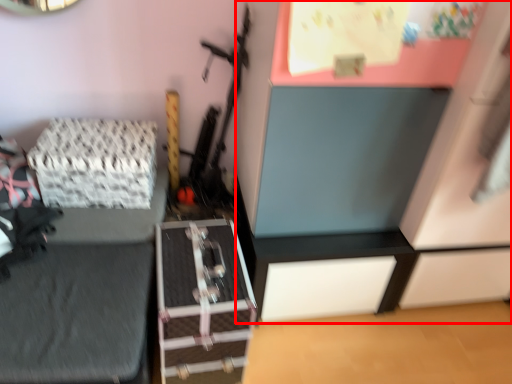
Question: From the image's perspective, what is the correct spatial relationship of dresser (annotated by the red box) in relation to package?

Choices:
 (A) below
 (B) above

Answer: (B)